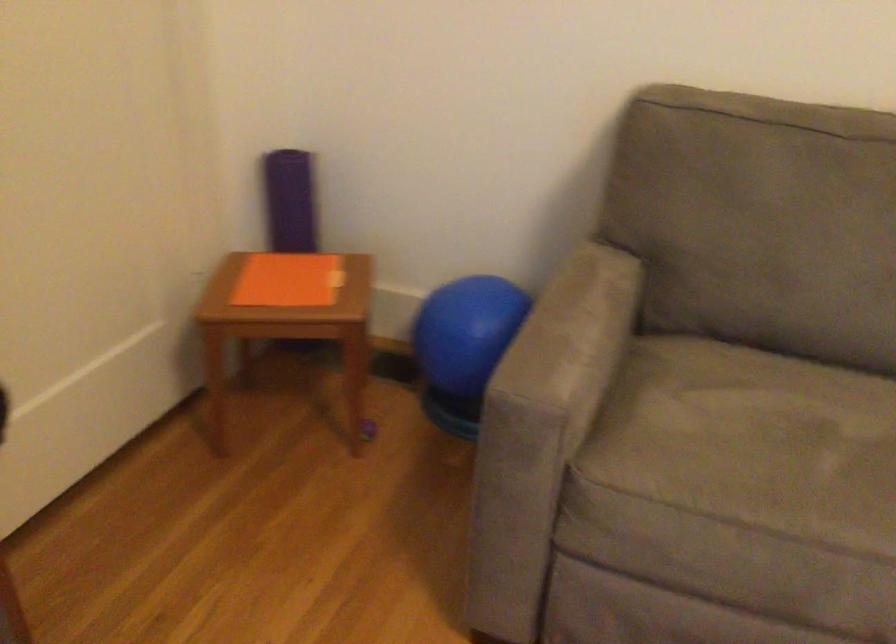
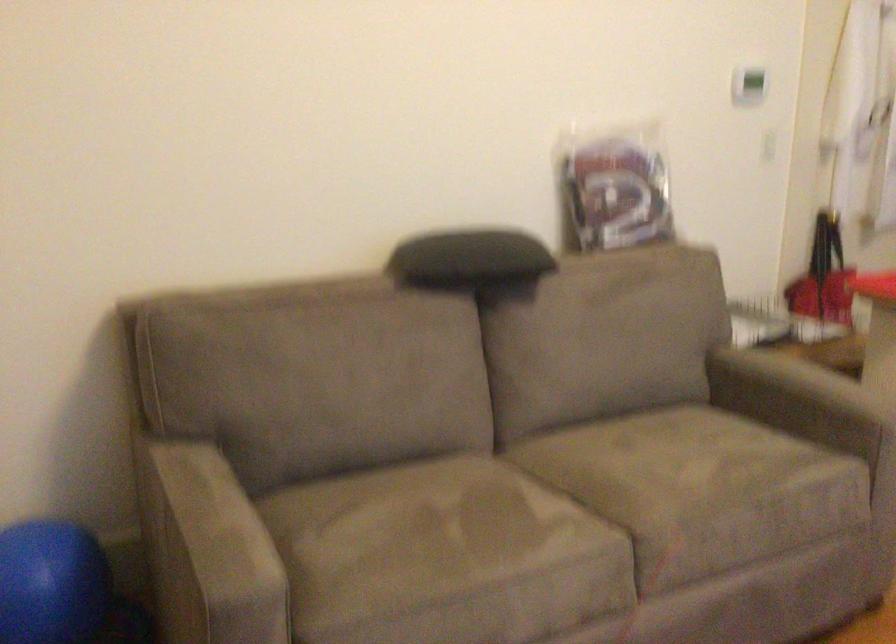
In the second image, find the point that corresponds to [538,352] in the first image.

(209, 550)